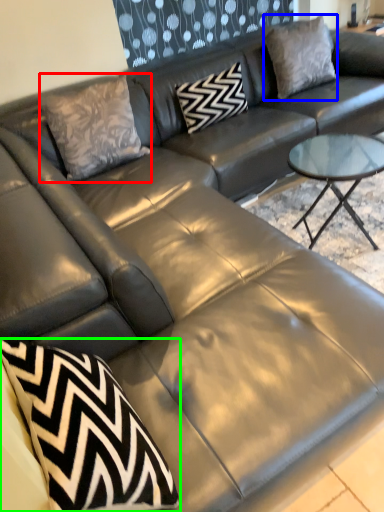
Question: Which object is the closest to the throw pillow (highlighted by a red box)? Choose among these: pillow (highlighted by a blue box) or throw pillow (highlighted by a green box).

Choices:
 (A) pillow
 (B) throw pillow

Answer: (A)